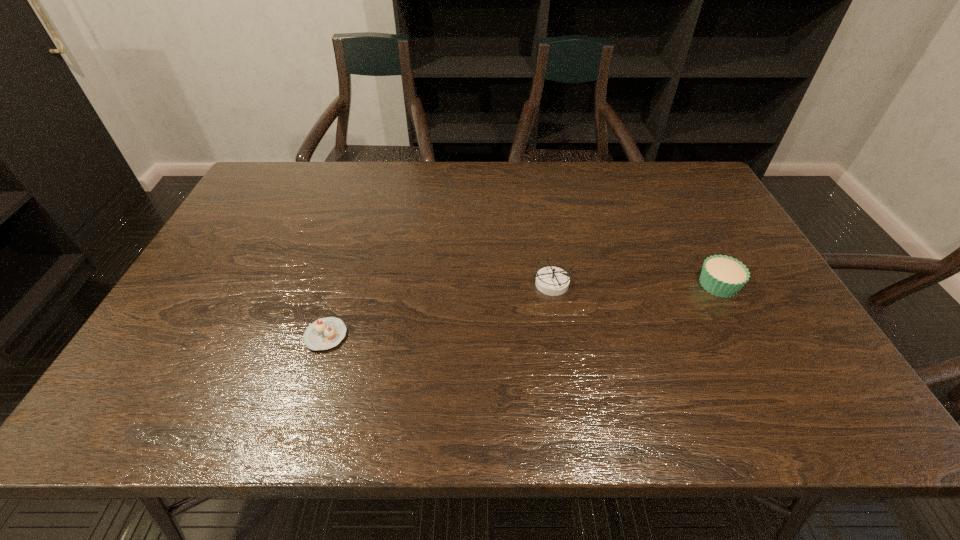
Where is `the second object from right to left`? the second object from right to left is located at coordinates (553, 281).

Identify the location of the rightmost object. Image resolution: width=960 pixels, height=540 pixels. (723, 276).

Locate an element on the screen. The width and height of the screenshot is (960, 540). the farther cupcake is located at coordinates tap(723, 276).

At what (x,y) coordinates should I click in order to perform the action: click on the shortest object. Please return your answer as a coordinate pair (x, y). Looking at the image, I should click on pos(325,333).

Identify the location of the shorter cupcake. point(325,333).

Where is `vacant space positioned 0.330m on the back of the compass`? vacant space positioned 0.330m on the back of the compass is located at coordinates (538, 199).

I want to click on vacant space located 0.280m on the back of the rightmost object, so click(x=678, y=208).

This screenshot has height=540, width=960. Find the location of `blank area located on the right of the shortest object`. blank area located on the right of the shortest object is located at coordinates (397, 335).

What are the coordinates of `object at the right edge` in the screenshot? It's located at (723, 276).

Find the location of a particular element. The width and height of the screenshot is (960, 540). free space at the far edge is located at coordinates (316, 187).